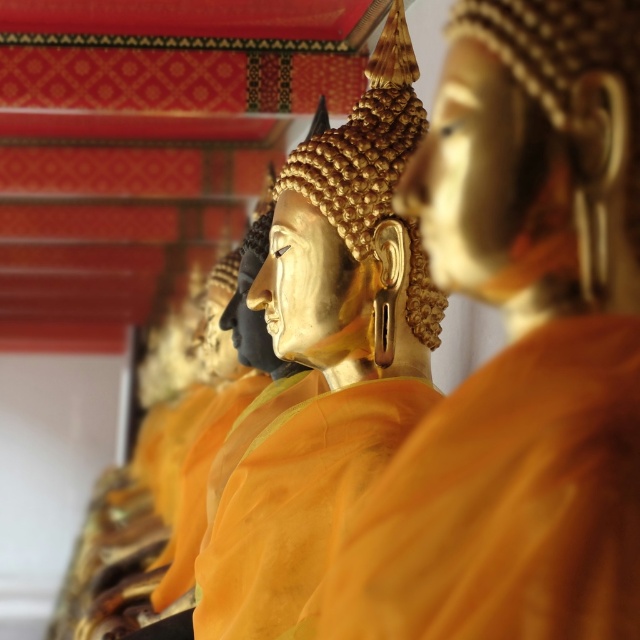
Can you confirm if gold polished statue at center is bigger than matte orange fabric at center?

Correct, gold polished statue at center is larger in size than matte orange fabric at center.

Which is more to the left, gold polished statue at center or matte orange fabric at center?

matte orange fabric at center

Is point (337, 212) less distant than point (253, 458)?

Yes, point (337, 212) is closer to viewer.

Locate an element on the screen. This screenshot has width=640, height=640. gold polished statue at center is located at coordinates point(326,353).

Is point (621, 356) positioned behind point (264, 470)?

No, it is not.

Is the position of gold shiny monk at center less distant than that of matte orange fabric at center?

Yes, it is in front of matte orange fabric at center.

Locate an element on the screen. gold shiny monk at center is located at coordinates (518, 346).

Can you confirm if gold shiny monk at center is taller than gold polished statue at center?

Incorrect, gold shiny monk at center's height is not larger of gold polished statue at center's.

Who is positioned more to the left, gold shiny monk at center or gold polished statue at center?

Positioned to the left is gold polished statue at center.

The height and width of the screenshot is (640, 640). I want to click on gold shiny monk at center, so click(x=518, y=346).